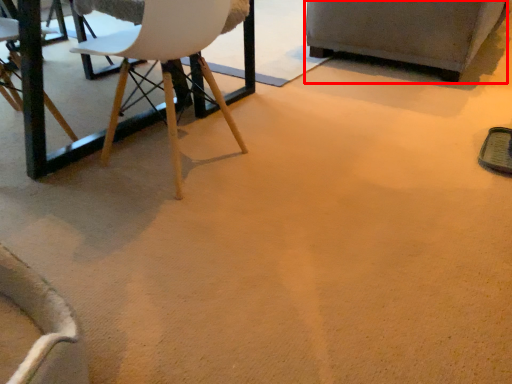
Question: From the image, what is the correct spatial relationship of armchair (annotated by the red box) in relation to chair?

Choices:
 (A) right
 (B) left

Answer: (A)